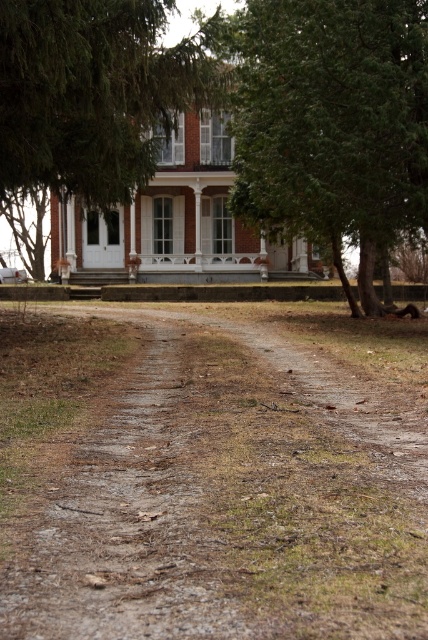
Is brown gravel path at center shorter than green leafy tree at upper left?

Yes, brown gravel path at center is shorter than green leafy tree at upper left.

How distant is brown gravel path at center from green leafy tree at upper left?

A distance of 6.08 meters exists between brown gravel path at center and green leafy tree at upper left.

Is point (397, 589) positioned in front of point (146, 106)?

Yes.

Image resolution: width=428 pixels, height=640 pixels. I want to click on brown gravel path at center, so click(204, 484).

Does brown gravel path at center have a larger size compared to green textured tree at center?

Incorrect, brown gravel path at center is not larger than green textured tree at center.

The height and width of the screenshot is (640, 428). Identify the location of brown gravel path at center. (204, 484).

Which is behind, point (247, 3) or point (139, 42)?

The point (247, 3) is behind.

What do you see at coordinates (332, 124) in the screenshot?
I see `green textured tree at center` at bounding box center [332, 124].

This screenshot has width=428, height=640. Identify the location of green textured tree at center. (332, 124).